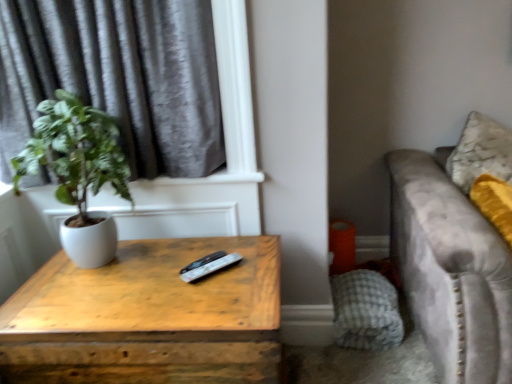
Measure the distance between gray checkered pillow at lower right and camera.

gray checkered pillow at lower right is 5.87 feet from camera.

What is the approximate width of white matte pot at left?

It is 36.52 centimeters.

Find the location of a particular element. This screenshot has height=384, width=512. gray checkered pillow at lower right is located at coordinates (366, 311).

From the image's perspective, is gray checkered pillow at lower right below wooden table at center?

Incorrect, from the image's perspective, gray checkered pillow at lower right is higher than wooden table at center.

Is gray checkered pillow at lower right aimed at wooden table at center?

No, gray checkered pillow at lower right does not turn towards wooden table at center.

From a real-world perspective, is gray checkered pillow at lower right above or below wooden table at center?

gray checkered pillow at lower right is situated lower than wooden table at center in the real world.

Can you tell me how much gray checkered pillow at lower right and wooden table at center differ in facing direction?

The angle between the facing direction of gray checkered pillow at lower right and the facing direction of wooden table at center is 90 degrees.

Does velvet gray couch at right turn towards white matte pot at left?

No, velvet gray couch at right does not turn towards white matte pot at left.

Is velvet gray couch at right with white matte pot at left?

No.

Considering the sizes of objects velvet gray couch at right and white matte pot at left in the image provided, who is shorter, velvet gray couch at right or white matte pot at left?

white matte pot at left is shorter.

Is black plastic remote at center completely or partially outside of wooden table at center?

Yes, black plastic remote at center is located beyond the bounds of wooden table at center.

From the image's perspective, is black plastic remote at center over wooden table at center?

Yes, from the image's perspective, black plastic remote at center is on top of wooden table at center.

Locate an element on the screen. The image size is (512, 384). remote that appears above the wooden table at center (from a real-world perspective) is located at coordinates coord(203,261).

Is black plastic remote at center shorter than wooden table at center?

Indeed, black plastic remote at center has a lesser height compared to wooden table at center.

Which point is more distant from viewer, (178,31) or (398,327)?

The point (398,327) is more distant.

Is gray velvet curtain at upper left wider than gray checkered pillow at lower right?

No.

Considering the sizes of gray velvet curtain at upper left and gray checkered pillow at lower right in the image, is gray velvet curtain at upper left taller or shorter than gray checkered pillow at lower right?

gray velvet curtain at upper left is taller than gray checkered pillow at lower right.

Considering the relative sizes of velvet gray couch at right and gray velvet curtain at upper left in the image provided, is velvet gray couch at right wider than gray velvet curtain at upper left?

Yes.

Which is in front, point (402, 160) or point (113, 62)?

The point (113, 62) is more forward.

How many degrees apart are the facing directions of velvet gray couch at right and gray velvet curtain at upper left?

velvet gray couch at right and gray velvet curtain at upper left are facing 0.000848 degrees away from each other.

Is velvet gray couch at right with gray velvet curtain at upper left?

No, velvet gray couch at right is not with gray velvet curtain at upper left.

Is black plastic remote at center outside of velvet gray couch at right?

Yes, black plastic remote at center is located beyond the bounds of velvet gray couch at right.

Does black plastic remote at center appear on the right side of velvet gray couch at right?

No.

Between black plastic remote at center and velvet gray couch at right, which one is positioned behind?

black plastic remote at center.

Is gray checkered pillow at lower right positioned with its back to gray velvet curtain at upper left?

gray checkered pillow at lower right is not turned away from gray velvet curtain at upper left.

This screenshot has height=384, width=512. Find the location of `pillow that is on the right side of gray velvet curtain at upper left`. pillow that is on the right side of gray velvet curtain at upper left is located at coordinates (366, 311).

Considering the sizes of gray checkered pillow at lower right and gray velvet curtain at upper left in the image, is gray checkered pillow at lower right wider or thinner than gray velvet curtain at upper left?

Clearly, gray checkered pillow at lower right has more width compared to gray velvet curtain at upper left.

Does gray checkered pillow at lower right have a larger size compared to gray velvet curtain at upper left?

No.

The height and width of the screenshot is (384, 512). What are the coordinates of `pillow above the wooden table at center (from the image's perspective)` in the screenshot? It's located at (366, 311).

Image resolution: width=512 pixels, height=384 pixels. I want to click on houseplant behind the velvet gray couch at right, so click(x=78, y=171).

Based on their spatial positions, is wooden table at center or velvet gray couch at right closer to gray checkered pillow at lower right?

velvet gray couch at right.

From the picture: Which object lies further to the anchor point black plastic remote at center, gray checkered pillow at lower right or velvet gray couch at right?

Among the two, velvet gray couch at right is located further to black plastic remote at center.

Which object lies further to the anchor point velvet gray couch at right, gray checkered pillow at lower right or white matte pot at left?

white matte pot at left is further to velvet gray couch at right.

When comparing their distances from white matte pot at left, does gray checkered pillow at lower right or gray velvet curtain at upper left seem closer?

The object closer to white matte pot at left is gray velvet curtain at upper left.

From the image, which object appears to be farther from white matte pot at left, wooden table at center or gray checkered pillow at lower right?

Based on the image, gray checkered pillow at lower right appears to be further to white matte pot at left.

From the image, which object appears to be nearer to gray checkered pillow at lower right, wooden table at center or white matte pot at left?

Among the two, wooden table at center is located nearer to gray checkered pillow at lower right.

From the image, which object appears to be farther from gray checkered pillow at lower right, velvet gray couch at right or black plastic remote at center?

Based on the image, black plastic remote at center appears to be further to gray checkered pillow at lower right.

Estimate the real-world distances between objects in this image. Which object is further from gray velvet curtain at upper left, wooden table at center or black plastic remote at center?

black plastic remote at center.

Where is `remote located between gray velvet curtain at upper left and gray checkered pillow at lower right in the left-right direction`? remote located between gray velvet curtain at upper left and gray checkered pillow at lower right in the left-right direction is located at coordinates (203, 261).

Identify the location of pillow between black plastic remote at center and velvet gray couch at right. The height and width of the screenshot is (384, 512). (366, 311).

You are a GUI agent. You are given a task and a screenshot of the screen. Output one action in this format:
    pyautogui.click(x=<x>, y=<y>)
    Task: Click on the pillow between white matte pot at left and velvet gray couch at right
    
    Given the screenshot: What is the action you would take?
    pyautogui.click(x=366, y=311)

Image resolution: width=512 pixels, height=384 pixels. What are the coordinates of `houseplant between gray velvet curtain at upper left and wooden table at center in the up-down direction` in the screenshot? It's located at (78, 171).